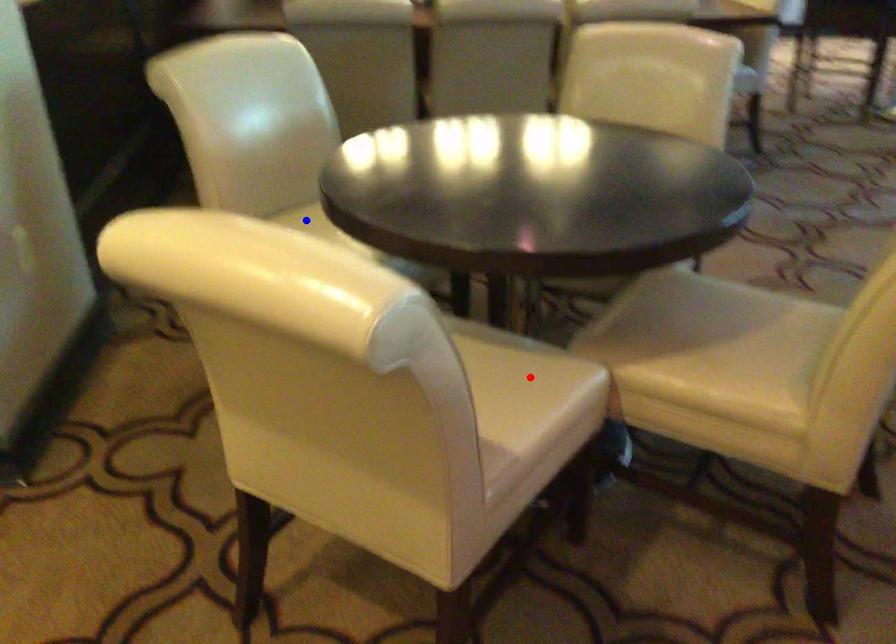
Question: Two points are marked on the image. Which point is closer to the camera?

Choices:
 (A) Blue point is closer.
 (B) Red point is closer.

Answer: (B)